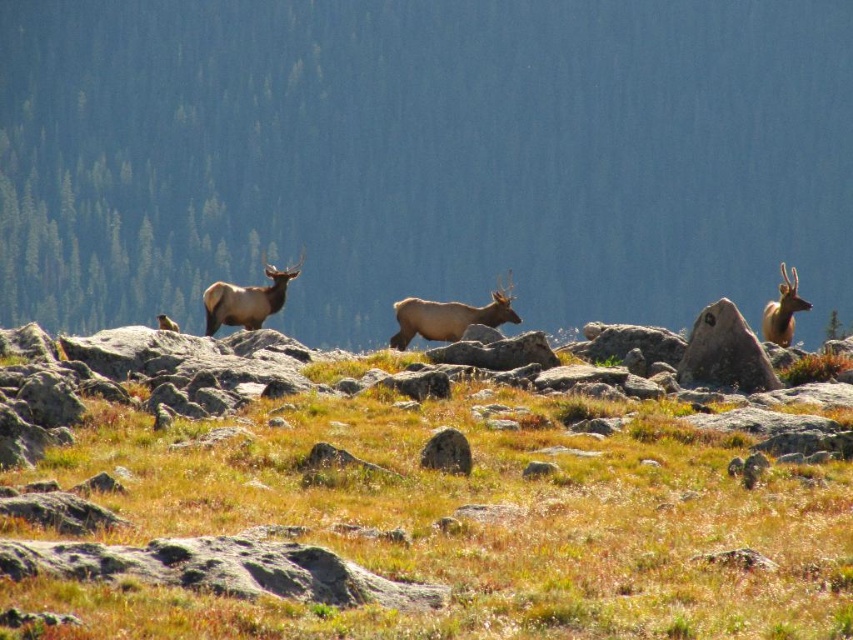
You are a hiker trying to cross the rocky terrain. You see the smooth gray rock at center right and the brown velvet deer at center. Which object is taller?

The smooth gray rock at center right is not as tall as the brown velvet deer at center, so the brown velvet deer at center is taller.

You are navigating through the rocky terrain and need to find the brown grassy area at center. According to the coordinates provided, where exactly is the brown grassy at center located?

The brown grassy at center is located at point (405, 497).